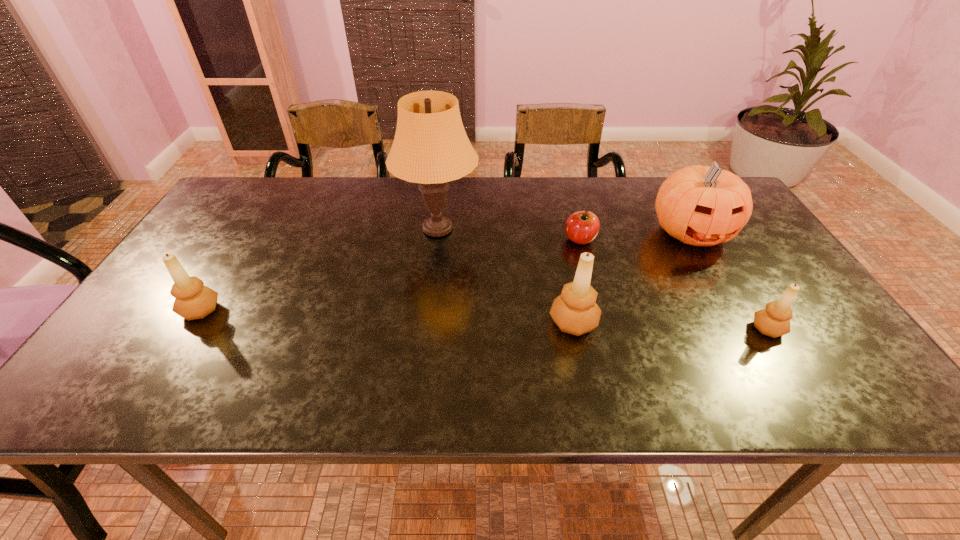
You are a GUI agent. You are given a task and a screenshot of the screen. Output one action in this format:
    pyautogui.click(x=<x>, y=<y>)
    Task: Click on the fourth tallest object
    The image size is (960, 540).
    Given the screenshot: What is the action you would take?
    pyautogui.click(x=193, y=300)

The height and width of the screenshot is (540, 960). What are the coordinates of `the leftmost candle_holder` in the screenshot? It's located at (193, 300).

The width and height of the screenshot is (960, 540). I want to click on the tallest candle_holder, so click(x=575, y=311).

Where is `the shortest candle_holder`? Image resolution: width=960 pixels, height=540 pixels. the shortest candle_holder is located at coordinates (774, 321).

Find the location of a particular element. This screenshot has width=960, height=540. the fifth tallest object is located at coordinates (774, 321).

The width and height of the screenshot is (960, 540). What are the coordinates of `pumpkin` in the screenshot? It's located at (699, 205).

Locate an element on the screen. This screenshot has width=960, height=540. lampshade is located at coordinates (430, 147).

Where is `the tallest object`? This screenshot has height=540, width=960. the tallest object is located at coordinates (430, 147).

This screenshot has width=960, height=540. Find the location of `apple`. apple is located at coordinates (582, 227).

The height and width of the screenshot is (540, 960). In order to click on free space located 0.090m on the front of the leftmost candle_holder in this screenshot , I will do `click(171, 358)`.